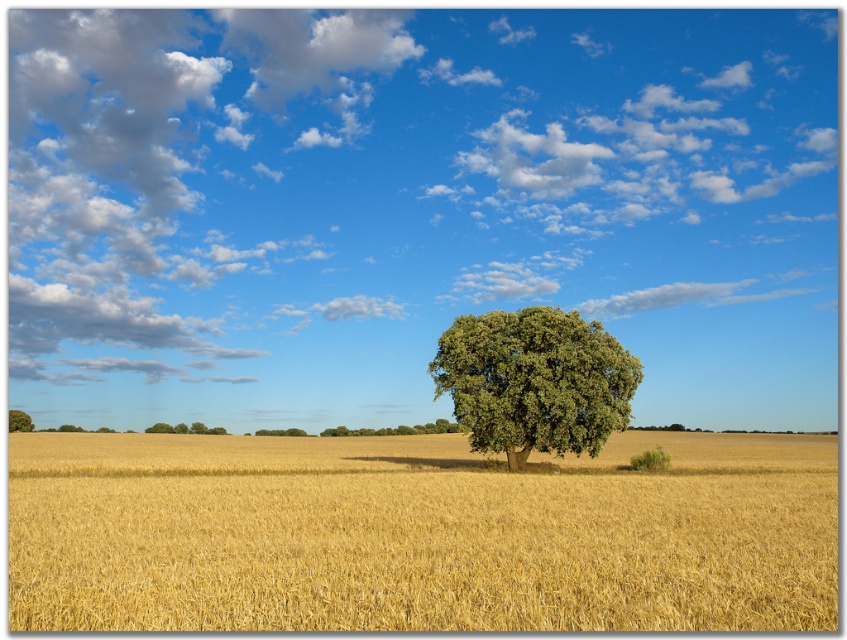
Question: Can you confirm if green leafy tree at center is thinner than green leafy tree at left?

Choices:
 (A) yes
 (B) no

Answer: (B)

Question: Among these points, which one is nearest to the camera?

Choices:
 (A) (518, 392)
 (B) (244, 266)

Answer: (A)

Question: Which object is farther from the camera taking this photo?

Choices:
 (A) green leafy tree at center
 (B) green leafy tree at left
 (C) white fluffy cloud at upper center

Answer: (C)

Question: Which point is farther to the camera?

Choices:
 (A) green leafy tree at center
 (B) white fluffy cloud at upper center
 (C) green leafy tree at left

Answer: (B)

Question: Can you confirm if golden matte wheat field at center is positioned above green leafy tree at left?

Choices:
 (A) no
 (B) yes

Answer: (B)

Question: Can you confirm if white fluffy cloud at upper center is positioned above green leafy tree at center?

Choices:
 (A) no
 (B) yes

Answer: (B)